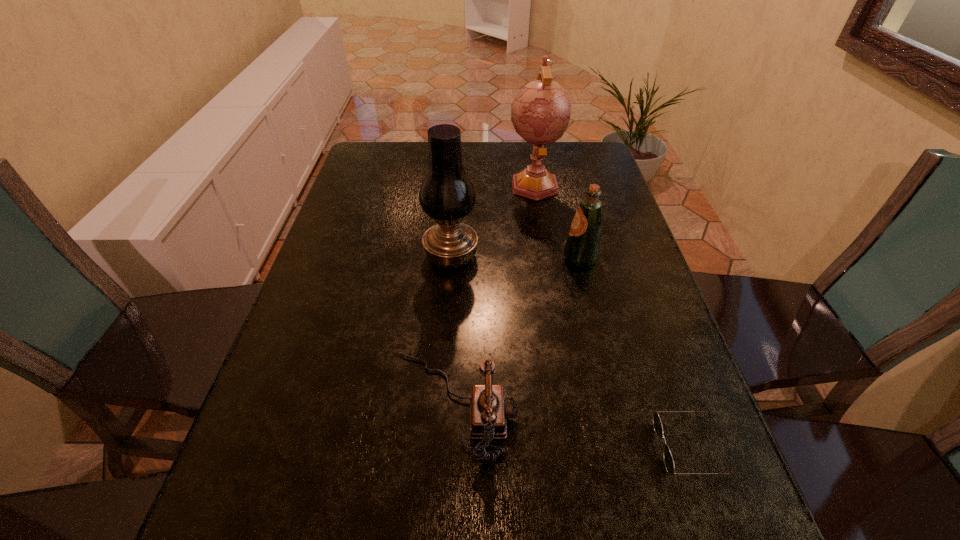
You are a GUI agent. You are given a task and a screenshot of the screen. Output one action in this format:
    pyautogui.click(x=<x>, y=<y>)
    Task: Click on the empty space between the telephone and the farthest object
    The image size is (960, 540).
    Given the screenshot: What is the action you would take?
    pyautogui.click(x=494, y=295)

The image size is (960, 540). I want to click on vacant area that lies between the globe and the third shortest object, so click(558, 221).

Point out which object is positioned as the nearest to the telephone. Please provide its 2D coordinates. Your answer should be formatted as a tuple, i.e. [(x, y)], where the tuple contains the x and y coordinates of a point satisfying the conditions above.

[(447, 195)]

The image size is (960, 540). I want to click on object that is the fourth nearest to the oil lamp, so click(x=657, y=425).